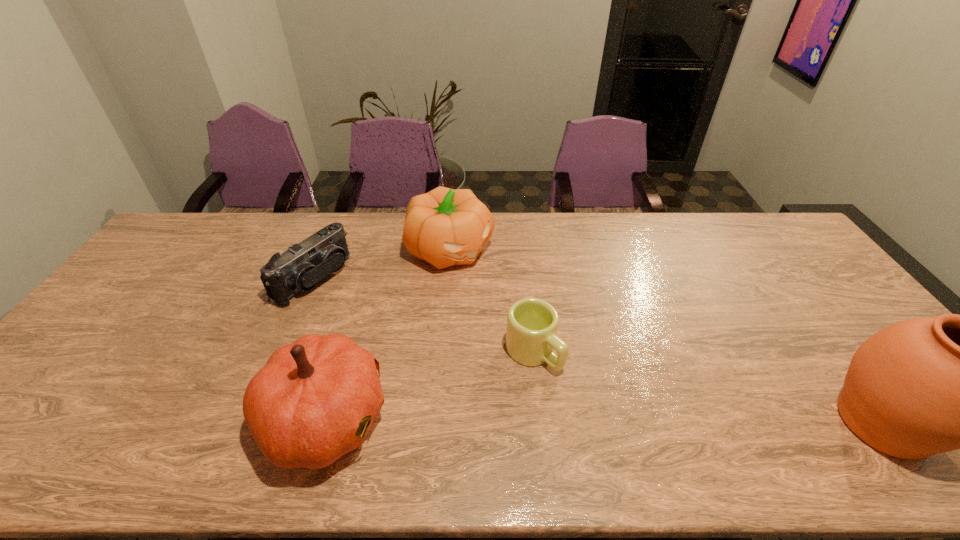
Where is `free space on the desktop that is between the nearer pumpkin and the rightmost object and is positioned with the handle on the side of the mug`? free space on the desktop that is between the nearer pumpkin and the rightmost object and is positioned with the handle on the side of the mug is located at coordinates (610, 421).

In order to click on vacant space on the desktop that is between the nearer pumpkin and the urn and is positioned on the carved face of the third tallest object in this screenshot , I will do `click(670, 421)`.

You are a GUI agent. You are given a task and a screenshot of the screen. Output one action in this format:
    pyautogui.click(x=<x>, y=<y>)
    Task: Click on the vacant space on the desktop that is between the nearer pumpkin and the urn and is positioned on the front-facing side of the camcorder
    Image resolution: width=960 pixels, height=540 pixels.
    Given the screenshot: What is the action you would take?
    pyautogui.click(x=548, y=420)